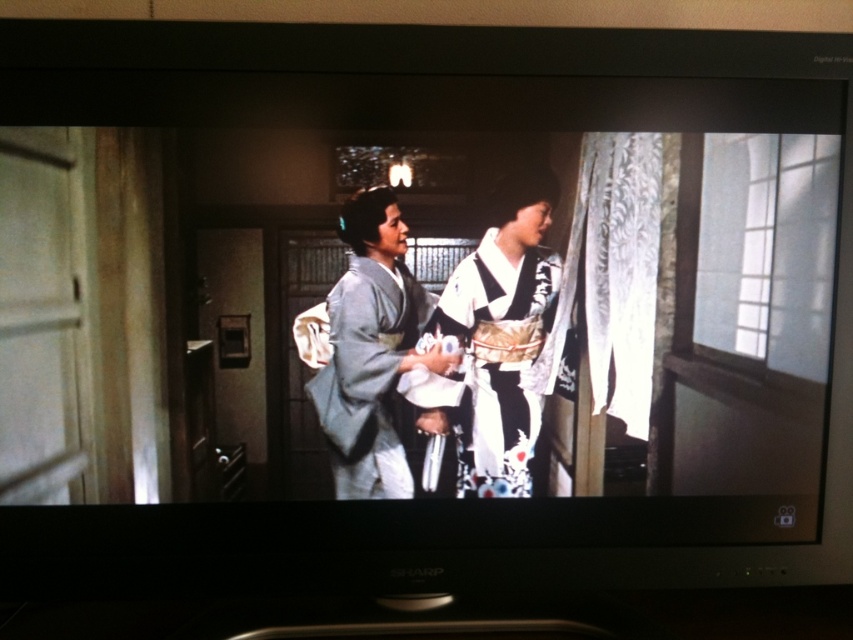
Is white silk kimono at center behind light gray silk kimono at center?

Yes.

Who is more forward, (518,355) or (338,496)?

Point (338,496)

Is point (529, 323) in front of point (387, 435)?

Yes, it is in front of point (387, 435).

Identify the location of white silk kimono at center. Image resolution: width=853 pixels, height=640 pixels. (491, 360).